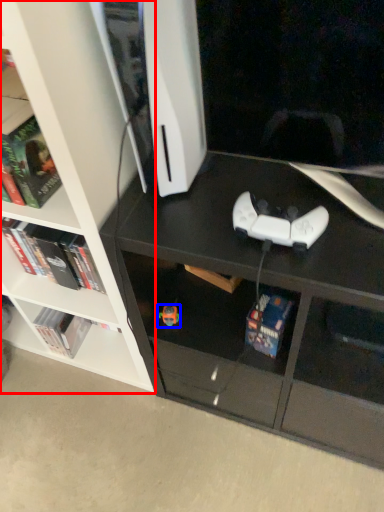
Question: Which of the following is the farthest to the observer, bookcase (highlighted by a red box) or toy (highlighted by a blue box)?

Choices:
 (A) bookcase
 (B) toy

Answer: (B)